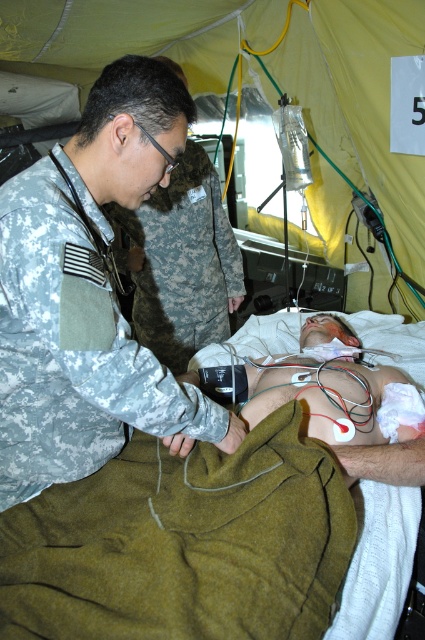
Question: Is camouflage uniform at center to the left of matte green tent at center from the viewer's perspective?

Choices:
 (A) no
 (B) yes

Answer: (B)

Question: Is camouflage uniform at center bigger than matte green tent at center?

Choices:
 (A) no
 (B) yes

Answer: (A)

Question: Does matte green tent at center appear under camo fabric uniform at upper left?

Choices:
 (A) yes
 (B) no

Answer: (B)

Question: Which object is closer to the camera taking this photo?

Choices:
 (A) camouflage uniform at center
 (B) matte green tent at center

Answer: (A)

Question: Which object is farther from the camera taking this photo?

Choices:
 (A) camo fabric uniform at upper left
 (B) matte green tent at center
 (C) camouflage uniform at center

Answer: (A)

Question: Which object is positioned farthest from the camouflage uniform at center?

Choices:
 (A) matte green tent at center
 (B) camo fabric uniform at upper left

Answer: (A)